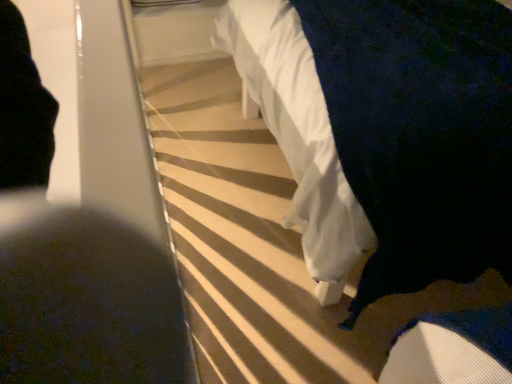
Question: From a real-world perspective, is white fabric bed at upper center positioned above or below dark fabric at lower left?

Choices:
 (A) above
 (B) below

Answer: (B)

Question: Considering the relative positions of white fabric bed at upper center and dark fabric at lower left in the image provided, is white fabric bed at upper center to the left or to the right of dark fabric at lower left?

Choices:
 (A) right
 (B) left

Answer: (A)

Question: Based on their sizes in the image, would you say white fabric bed at upper center is bigger or smaller than dark fabric at lower left?

Choices:
 (A) small
 (B) big

Answer: (A)

Question: Which is correct: dark fabric at lower left is inside white fabric bed at upper center, or outside of it?

Choices:
 (A) inside
 (B) outside

Answer: (B)

Question: In terms of width, does dark fabric at lower left look wider or thinner when compared to white fabric bed at upper center?

Choices:
 (A) thin
 (B) wide

Answer: (A)

Question: Considering the positions of dark fabric at lower left and white fabric bed at upper center in the image, is dark fabric at lower left bigger or smaller than white fabric bed at upper center?

Choices:
 (A) small
 (B) big

Answer: (B)

Question: Is point [131, 279] positioned closer to the camera than point [484, 100]?

Choices:
 (A) farther
 (B) closer

Answer: (A)